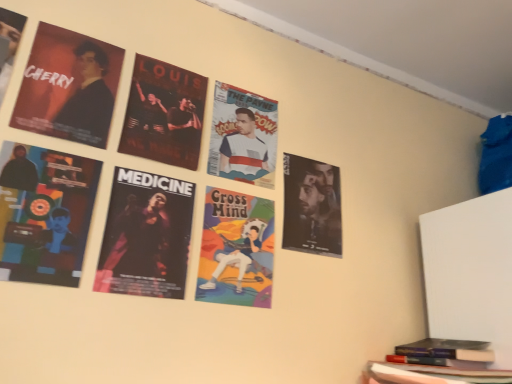
Image resolution: width=512 pixels, height=384 pixels. What do you see at coordinates (164, 113) in the screenshot? I see `matte black poster at upper center, which appears as the second poster when viewed from the right` at bounding box center [164, 113].

What do you see at coordinates (69, 87) in the screenshot? The width and height of the screenshot is (512, 384). I see `matte black poster at upper left, which ranks as the 4th poster in right-to-left order` at bounding box center [69, 87].

What is the approximate width of matte black poster at right, the sixth poster when ordered from left to right?

The width of matte black poster at right, the sixth poster when ordered from left to right, is 1.29 centimeters.

Based on the photo, in order to face dark matte poster at center-left, which ranks as the fourth poster in left-to-right order, should I rotate leftwards or rightwards?

You should look left and rotate roughly 14.002 degrees.

This screenshot has height=384, width=512. Identify the location of hardcover book at lower right. (443, 352).

You are a GUI agent. You are given a task and a screenshot of the screen. Output one action in this format:
    pyautogui.click(x=<x>, y=<y>)
    Task: Click on the matte black poster at upper center, which appears as the second poster when viewed from the right
    The image size is (512, 384).
    Given the screenshot: What is the action you would take?
    (164, 113)

Would you say matte black poster at upper center, which appears as the second poster when viewed from the right, is to the left or to the right of matte black poster at upper left, the third poster when ordered from left to right, in the picture?

From the image, it's evident that matte black poster at upper center, which appears as the second poster when viewed from the right, is to the right of matte black poster at upper left, the third poster when ordered from left to right.

Does matte black poster at upper center, which appears as the second poster when viewed from the right, have a larger size compared to matte black poster at upper left, the third poster when ordered from left to right?

Indeed, matte black poster at upper center, which appears as the second poster when viewed from the right, has a larger size compared to matte black poster at upper left, the third poster when ordered from left to right.

Considering the points (185, 131) and (101, 96), which point is in front, point (185, 131) or point (101, 96)?

The point (101, 96) is closer.

Looking at this image, from a real-world perspective, between matte black poster at upper center, which appears as the second poster when viewed from the right, and matte black poster at upper left, the third poster when ordered from left to right, who is vertically higher?

matte black poster at upper center, which appears as the second poster when viewed from the right.

Considering the sizes of objects matte black poster at upper left, the sixth poster when ordered from right to left, and matte black poster at upper left, which ranks as the 4th poster in right-to-left order, in the image provided, who is wider, matte black poster at upper left, the sixth poster when ordered from right to left, or matte black poster at upper left, which ranks as the 4th poster in right-to-left order,?

matte black poster at upper left, which ranks as the 4th poster in right-to-left order.

From a real-world perspective, which object rests below the other?

matte black poster at upper left, which ranks as the 4th poster in right-to-left order, from a real-world perspective.

Considering the relative positions of matte black poster at upper left, the 1th poster in the left-to-right sequence, and matte black poster at upper left, the third poster when ordered from left to right, in the image provided, is matte black poster at upper left, the 1th poster in the left-to-right sequence, in front of matte black poster at upper left, the third poster when ordered from left to right,?

Yes, it is in front of matte black poster at upper left, the third poster when ordered from left to right.

Is point (6, 79) more distant than point (64, 109)?

No, (6, 79) is in front of (64, 109).

From a real-world perspective, which object rests below the other?

From a 3D spatial view, cartoonish paper poster at center is below.

Does matte black poster at upper center, the 5th poster when ordered from left to right, have a lesser width compared to cartoonish paper poster at center?

No.

Does matte black poster at upper center, the 5th poster when ordered from left to right, have a lesser height compared to cartoonish paper poster at center?

No.

Can you confirm if matte black poster at upper center, the 5th poster when ordered from left to right, is smaller than cartoonish paper poster at center?

Incorrect, matte black poster at upper center, the 5th poster when ordered from left to right, is not smaller in size than cartoonish paper poster at center.

Considering the positions of objects matte black poster at upper left, which ranks as the 4th poster in right-to-left order, and hardcover book at lower right in the image provided, who is more to the left, matte black poster at upper left, which ranks as the 4th poster in right-to-left order, or hardcover book at lower right?

Positioned to the left is matte black poster at upper left, which ranks as the 4th poster in right-to-left order.

Which is correct: matte black poster at upper left, which ranks as the 4th poster in right-to-left order, is inside hardcover book at lower right, or outside of it?

matte black poster at upper left, which ranks as the 4th poster in right-to-left order, is not enclosed by hardcover book at lower right.

Based on the photo, is matte black poster at upper left, the third poster when ordered from left to right, shorter than hardcover book at lower right?

No, matte black poster at upper left, the third poster when ordered from left to right, is not shorter than hardcover book at lower right.

Considering the sizes of objects matte black poster at upper left, which ranks as the 4th poster in right-to-left order, and hardcover book at lower right in the image provided, who is smaller, matte black poster at upper left, which ranks as the 4th poster in right-to-left order, or hardcover book at lower right?

matte black poster at upper left, which ranks as the 4th poster in right-to-left order.

Is hardcover book at lower right next to matte black poster at upper left, the sixth poster when ordered from right to left?

No.

How many degrees apart are the facing directions of hardcover book at lower right and matte black poster at upper left, the sixth poster when ordered from right to left?

hardcover book at lower right and matte black poster at upper left, the sixth poster when ordered from right to left, are facing 2.04 degrees away from each other.

Considering the relative sizes of hardcover book at lower right and matte black poster at upper left, the 1th poster in the left-to-right sequence, in the image provided, is hardcover book at lower right bigger than matte black poster at upper left, the 1th poster in the left-to-right sequence,?

Yes, hardcover book at lower right is bigger than matte black poster at upper left, the 1th poster in the left-to-right sequence.

Which is behind, point (465, 361) or point (17, 40)?

The point (465, 361) is farther.

Does point (0, 96) come in front of point (323, 202)?

That is True.

Considering the relative sizes of matte black poster at upper left, the sixth poster when ordered from right to left, and matte black poster at right, the 1th poster when ordered from right to left, in the image provided, is matte black poster at upper left, the sixth poster when ordered from right to left, bigger than matte black poster at right, the 1th poster when ordered from right to left,?

Indeed, matte black poster at upper left, the sixth poster when ordered from right to left, has a larger size compared to matte black poster at right, the 1th poster when ordered from right to left.

Looking at this image, is matte black poster at upper left, the 1th poster in the left-to-right sequence, oriented towards matte black poster at right, the sixth poster when ordered from left to right?

No, matte black poster at upper left, the 1th poster in the left-to-right sequence, is not facing towards matte black poster at right, the sixth poster when ordered from left to right.

Is the surface of matte black poster at upper left, the 1th poster in the left-to-right sequence, in direct contact with matte black poster at right, the 1th poster when ordered from right to left?

No, matte black poster at upper left, the 1th poster in the left-to-right sequence, is not touching matte black poster at right, the 1th poster when ordered from right to left.

Identify the location of book lying below the matte black poster at upper center, the 5th poster when ordered from left to right (from the image's perspective). The height and width of the screenshot is (384, 512). (443, 352).

Which is more to the left, hardcover book at lower right or matte black poster at upper center, which appears as the second poster when viewed from the right?

matte black poster at upper center, which appears as the second poster when viewed from the right.

Considering the relative positions of hardcover book at lower right and matte black poster at upper center, the 5th poster when ordered from left to right, in the image provided, is hardcover book at lower right in front of matte black poster at upper center, the 5th poster when ordered from left to right,?

Yes, hardcover book at lower right is closer to the camera.

Considering the sizes of hardcover book at lower right and matte black poster at upper center, the 5th poster when ordered from left to right, in the image, is hardcover book at lower right wider or thinner than matte black poster at upper center, the 5th poster when ordered from left to right,?

Considering their sizes, hardcover book at lower right looks broader than matte black poster at upper center, the 5th poster when ordered from left to right.

The height and width of the screenshot is (384, 512). In order to click on the 2nd poster to the right of the matte black poster at upper left, which ranks as the 4th poster in right-to-left order, counting from the anchor's position in this screenshot , I will do `click(164, 113)`.

You are a GUI agent. You are given a task and a screenshot of the screen. Output one action in this format:
    pyautogui.click(x=<x>, y=<y>)
    Task: Click on the 1st poster below the matte black poster at upper left, the sixth poster when ordered from right to left (from a real-world perspective)
    
    Given the screenshot: What is the action you would take?
    pyautogui.click(x=69, y=87)

Considering their positions, is matte black poster at right, the 1th poster when ordered from right to left, positioned closer to matte black poster at upper left, the sixth poster when ordered from right to left, than dark matte poster at center-left, marked as the third poster in a right-to-left arrangement?

The object closer to matte black poster at upper left, the sixth poster when ordered from right to left, is dark matte poster at center-left, marked as the third poster in a right-to-left arrangement.

Estimate the real-world distances between objects in this image. Which object is closer to dark matte poster at center-left, marked as the third poster in a right-to-left arrangement, hardcover book at lower right or matte black poster at upper center, which appears as the second poster when viewed from the right?

Based on the image, matte black poster at upper center, which appears as the second poster when viewed from the right, appears to be nearer to dark matte poster at center-left, marked as the third poster in a right-to-left arrangement.

Considering their positions, is cartoonish paper poster at center positioned closer to matte black poster at upper left, which ranks as the 4th poster in right-to-left order, than matte black poster at upper center, which appears as the second poster when viewed from the right?

matte black poster at upper center, which appears as the second poster when viewed from the right, lies closer to matte black poster at upper left, which ranks as the 4th poster in right-to-left order, than the other object.

When comparing their distances from hardcover book at lower right, does matte black poster at right, the 1th poster when ordered from right to left, or matte black poster at upper center, which appears as the second poster when viewed from the right, seem closer?

matte black poster at right, the 1th poster when ordered from right to left, lies closer to hardcover book at lower right than the other object.

Looking at the image, which one is located closer to dark matte poster at center-left, marked as the third poster in a right-to-left arrangement, hardcover book at lower right or matte black poster at right, the 1th poster when ordered from right to left?

matte black poster at right, the 1th poster when ordered from right to left.

Based on their spatial positions, is hardcover book at lower right or matte black poster at upper left, the sixth poster when ordered from right to left, further from matte black poster at upper left, which ranks as the 4th poster in right-to-left order?

hardcover book at lower right lies further to matte black poster at upper left, which ranks as the 4th poster in right-to-left order, than the other object.

Which object lies further to the anchor point matte black poster at upper left, the 1th poster in the left-to-right sequence, matte black poster at lower left, the second poster from the left, or cartoonish paper poster at center?

cartoonish paper poster at center.

Based on their spatial positions, is matte black poster at upper left, the 1th poster in the left-to-right sequence, or matte black poster at lower left, the 5th poster in the right-to-left sequence, closer to matte black poster at upper left, the third poster when ordered from left to right?

matte black poster at upper left, the 1th poster in the left-to-right sequence.

You are a GUI agent. You are given a task and a screenshot of the screen. Output one action in this format:
    pyautogui.click(x=<x>, y=<y>)
    Task: Click on the person situated between matte black poster at upper left, which ranks as the 4th poster in right-to-left order, and hardcover book at lower right from left to right
    The height and width of the screenshot is (384, 512).
    Given the screenshot: What is the action you would take?
    pyautogui.click(x=236, y=259)

This screenshot has width=512, height=384. What are the coordinates of `person between dark matte poster at center-left, which ranks as the fourth poster in left-to-right order, and hardcover book at lower right, in the horizontal direction` in the screenshot? It's located at (236, 259).

You are a GUI agent. You are given a task and a screenshot of the screen. Output one action in this format:
    pyautogui.click(x=<x>, y=<y>)
    Task: Click on the person located between matte black poster at lower left, the second poster from the left, and hardcover book at lower right in the left-right direction
    The image size is (512, 384).
    Given the screenshot: What is the action you would take?
    pyautogui.click(x=236, y=259)

The width and height of the screenshot is (512, 384). I want to click on person situated between matte black poster at upper left, which ranks as the 4th poster in right-to-left order, and matte black poster at right, the 1th poster when ordered from right to left, from left to right, so [236, 259].